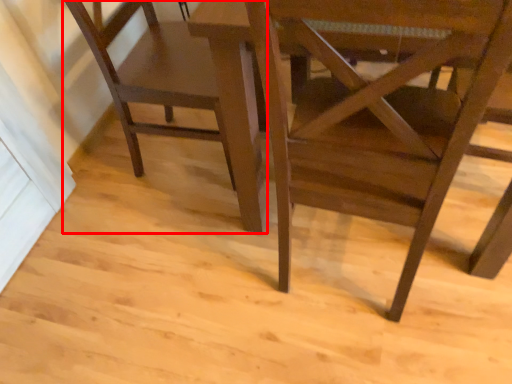
Question: In this image, where is chair (annotated by the red box) located relative to chair?

Choices:
 (A) left
 (B) right

Answer: (A)